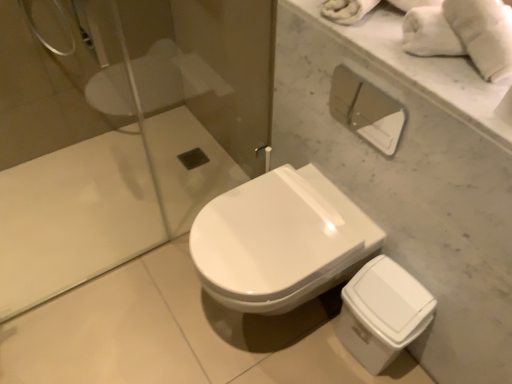
Question: Is white fluffy towel at upper right at the back of white glossy toilet at center?

Choices:
 (A) no
 (B) yes

Answer: (A)

Question: Is white glossy toilet at center shorter than white fluffy towel at upper right?

Choices:
 (A) no
 (B) yes

Answer: (A)

Question: Is white glossy toilet at center completely or partially outside of white fluffy towel at upper right?

Choices:
 (A) no
 (B) yes

Answer: (B)

Question: From a real-world perspective, is white glossy toilet at center below white fluffy towel at upper right?

Choices:
 (A) no
 (B) yes

Answer: (B)

Question: Can you confirm if white glossy toilet at center is thinner than white fluffy towel at upper right?

Choices:
 (A) no
 (B) yes

Answer: (A)

Question: From a real-world perspective, relative to white glossy toilet at center, is white fluffy towel at upper right vertically above or below?

Choices:
 (A) below
 (B) above

Answer: (B)

Question: In terms of size, does white fluffy towel at upper right appear bigger or smaller than white glossy toilet at center?

Choices:
 (A) small
 (B) big

Answer: (A)

Question: Considering the positions of point [x=486, y=31] and point [x=296, y=246], is point [x=486, y=31] closer or farther from the camera than point [x=296, y=246]?

Choices:
 (A) closer
 (B) farther

Answer: (A)

Question: Choose the correct answer: Is white fluffy towel at upper right inside white glossy toilet at center or outside it?

Choices:
 (A) outside
 (B) inside

Answer: (A)

Question: From their relative heights in the image, would you say white matte toilet paper at upper right is taller or shorter than white glossy toilet at center?

Choices:
 (A) short
 (B) tall

Answer: (A)

Question: In terms of width, does white matte toilet paper at upper right look wider or thinner when compared to white glossy toilet at center?

Choices:
 (A) thin
 (B) wide

Answer: (A)

Question: Is point (372, 117) positioned closer to the camera than point (289, 263)?

Choices:
 (A) closer
 (B) farther

Answer: (B)

Question: From the image's perspective, is white matte toilet paper at upper right located above or below white glossy toilet at center?

Choices:
 (A) below
 (B) above

Answer: (B)

Question: Which is correct: white glossy toilet at center is inside white matte toilet paper at upper right, or outside of it?

Choices:
 (A) outside
 (B) inside

Answer: (A)

Question: Is point (243, 286) closer or farther from the camera than point (390, 132)?

Choices:
 (A) farther
 (B) closer

Answer: (A)